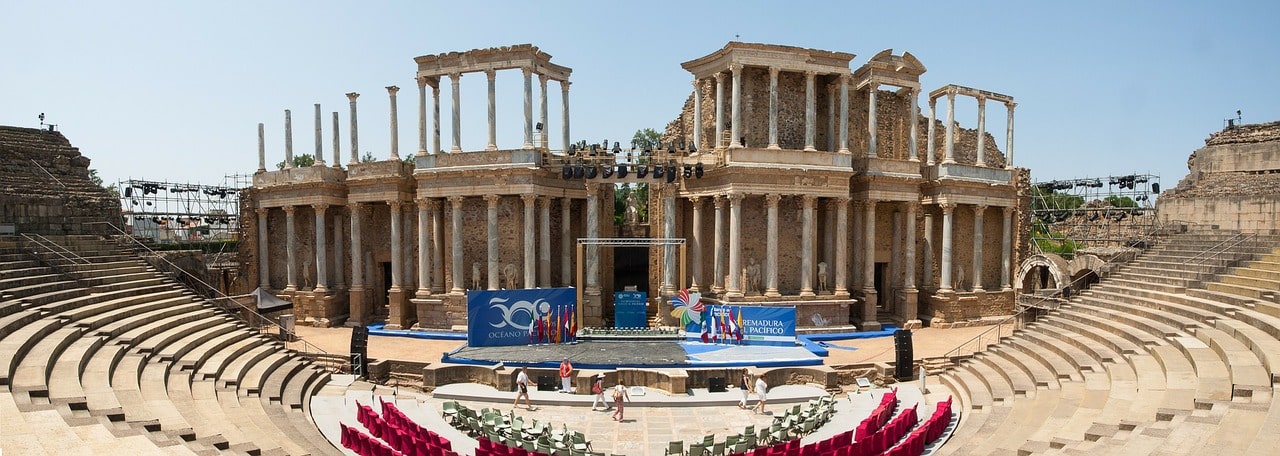
Locate an element on the screen. stage is located at coordinates (621, 350).